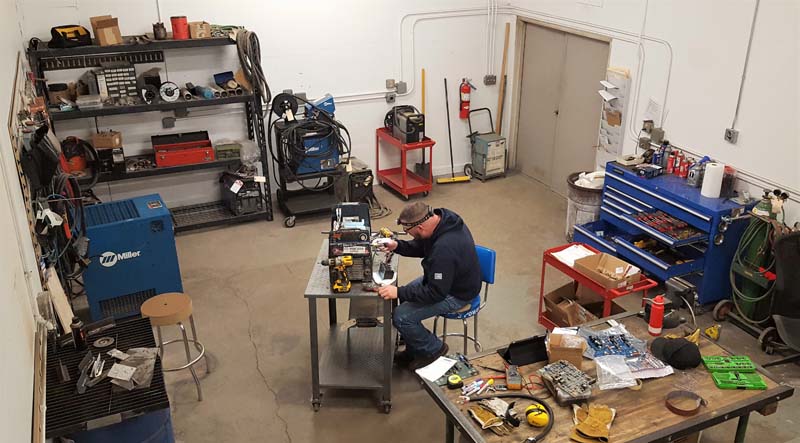
Locate an element on the screen. The width and height of the screenshot is (800, 443). table is located at coordinates (318, 282).